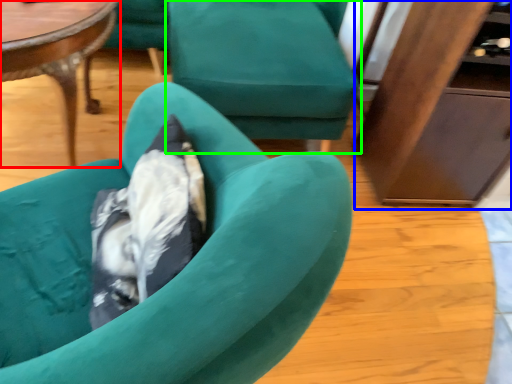
Question: Which object is positioned closest to coffee table (highlighted by a red box)? Select from dresser (highlighted by a blue box) and chair (highlighted by a green box).

Choices:
 (A) dresser
 (B) chair

Answer: (B)